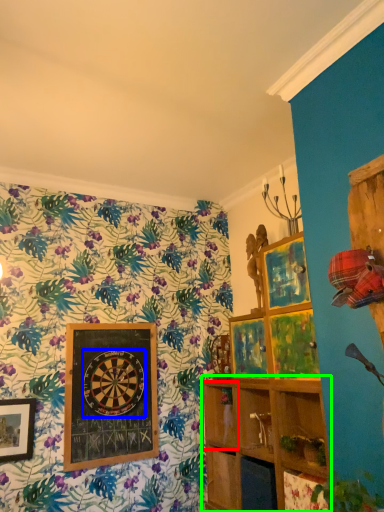
Question: Considering the real-world distances, which object is closest to shelf (highlighted by a red box)? design (highlighted by a blue box) or shelf (highlighted by a green box).

Choices:
 (A) design
 (B) shelf

Answer: (B)